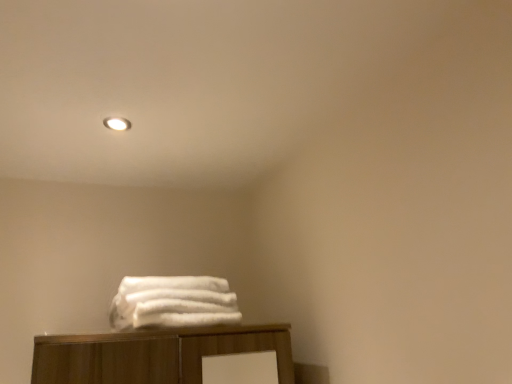
What do you see at coordinates (173, 302) in the screenshot? I see `white fluffy towels at center` at bounding box center [173, 302].

Locate an element on the screen. The width and height of the screenshot is (512, 384). white fluffy towels at center is located at coordinates (173, 302).

What do you see at coordinates (117, 124) in the screenshot? This screenshot has height=384, width=512. I see `matte white light fixture at upper center` at bounding box center [117, 124].

Locate an element on the screen. matte white light fixture at upper center is located at coordinates (117, 124).

In order to face matte white light fixture at upper center, should I rotate leftwards or rightwards?

To align with it, rotate left about 17.766°.

Measure the distance between matte white light fixture at upper center and camera.

The depth of matte white light fixture at upper center is 4.40 feet.

At what (x,y) coordinates should I click in order to perform the action: click on white fluffy towels at center. Please return your answer as a coordinate pair (x, y). This screenshot has width=512, height=384. Looking at the image, I should click on (173, 302).

Can you confirm if white fluffy towels at center is positioned to the left of matte white light fixture at upper center?

In fact, white fluffy towels at center is to the right of matte white light fixture at upper center.

Which is in front, white fluffy towels at center or matte white light fixture at upper center?

white fluffy towels at center is more forward.

Is point (118, 314) closer or farther from the camera than point (108, 122)?

Point (118, 314) appears to be closer to the viewer than point (108, 122).

From the image's perspective, is white fluffy towels at center under matte white light fixture at upper center?

Yes, from the image's perspective, white fluffy towels at center is beneath matte white light fixture at upper center.

From a real-world perspective, is white fluffy towels at center physically below matte white light fixture at upper center?

Yes, from a real-world perspective, white fluffy towels at center is under matte white light fixture at upper center.

Looking at this image, in terms of width, does white fluffy towels at center look wider or thinner when compared to matte white light fixture at upper center?

In the image, white fluffy towels at center appears to be wider than matte white light fixture at upper center.

Between white fluffy towels at center and matte white light fixture at upper center, which one has less height?

matte white light fixture at upper center.

Between white fluffy towels at center and matte white light fixture at upper center, which one has larger size?

Bigger between the two is white fluffy towels at center.

Looking at this image, is matte white light fixture at upper center completely or partially inside white fluffy towels at center?

Definitely not — matte white light fixture at upper center is not inside white fluffy towels at center.

Is white fluffy towels at center positioned far away from matte white light fixture at upper center?

white fluffy towels at center is actually quite close to matte white light fixture at upper center.

Could you tell me if white fluffy towels at center is facing matte white light fixture at upper center?

No, white fluffy towels at center is not turned towards matte white light fixture at upper center.

Image resolution: width=512 pixels, height=384 pixels. In order to click on towel on the right of matte white light fixture at upper center in this screenshot , I will do `click(173, 302)`.

Is matte white light fixture at upper center at the left side of white fluffy towels at center?

Correct, you'll find matte white light fixture at upper center to the left of white fluffy towels at center.

Is matte white light fixture at upper center in front of white fluffy towels at center?

That is False.

Does point (111, 122) come farther from viewer compared to point (180, 309)?

That is True.

From the image's perspective, relative to white fluffy towels at center, is matte white light fixture at upper center above or below?

Based on their image positions, matte white light fixture at upper center is located above white fluffy towels at center.

From a real-world perspective, which is physically above, matte white light fixture at upper center or white fluffy towels at center?

From a 3D spatial view, matte white light fixture at upper center is above.

Can you confirm if matte white light fixture at upper center is thinner than white fluffy towels at center?

Yes, matte white light fixture at upper center is thinner than white fluffy towels at center.

In terms of height, does matte white light fixture at upper center look taller or shorter compared to white fluffy towels at center?

Clearly, matte white light fixture at upper center is shorter compared to white fluffy towels at center.

Considering the relative sizes of matte white light fixture at upper center and white fluffy towels at center in the image provided, is matte white light fixture at upper center smaller than white fluffy towels at center?

Yes.

Is matte white light fixture at upper center situated inside white fluffy towels at center or outside?

matte white light fixture at upper center is located beyond the bounds of white fluffy towels at center.

From the picture: Is matte white light fixture at upper center far away from white fluffy towels at center?

No, matte white light fixture at upper center is in close proximity to white fluffy towels at center.

Is matte white light fixture at upper center facing away from white fluffy towels at center?

matte white light fixture at upper center is not turned away from white fluffy towels at center.

Looking at this image, how many degrees apart are the facing directions of matte white light fixture at upper center and white fluffy towels at center?

They differ by 83.5 degrees in their facing directions.

Find the location of a particular element. lighting on the left of white fluffy towels at center is located at coordinates (117, 124).

In the image, there is a matte white light fixture at upper center. Where is `towel below it (from a real-world perspective)`? This screenshot has height=384, width=512. towel below it (from a real-world perspective) is located at coordinates (173, 302).

Identify the location of lighting above the white fluffy towels at center (from a real-world perspective). (117, 124).